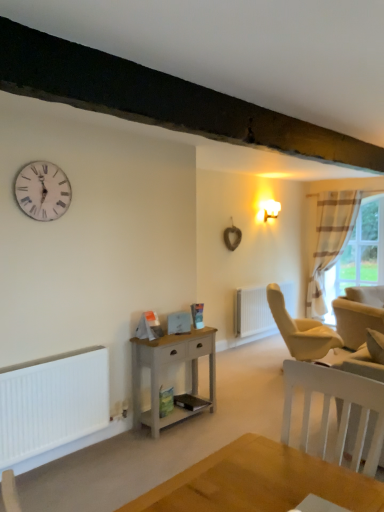
Question: Considering the positions of point (29, 172) and point (254, 313), is point (29, 172) closer or farther from the camera than point (254, 313)?

Choices:
 (A) farther
 (B) closer

Answer: (B)

Question: Is white wooden clock at upper left spatially inside white matte radiator at center, or outside of it?

Choices:
 (A) inside
 (B) outside

Answer: (B)

Question: Which object is positioned closest to the striped fabric curtain at right?

Choices:
 (A) plaid fabric curtain at right
 (B) beige fabric swivel chair at right
 (C) white wooden clock at upper left
 (D) white matte heater at lower left
 (E) light gray wood nightstand at center

Answer: (A)

Question: Considering the real-world distances, which object is farthest from the striped fabric curtain at right?

Choices:
 (A) white matte radiator at center
 (B) light gray wood nightstand at center
 (C) plaid fabric curtain at right
 (D) beige fabric swivel chair at right
 (E) matte gold wall sconce at upper right

Answer: (B)